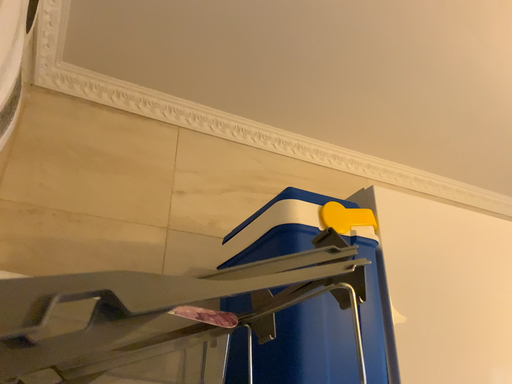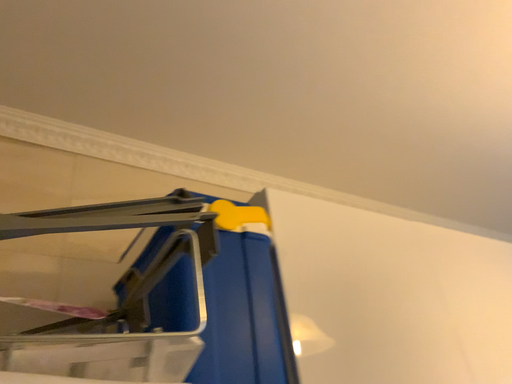
Question: Which way did the camera rotate in the video?

Choices:
 (A) rotated right
 (B) rotated left

Answer: (A)